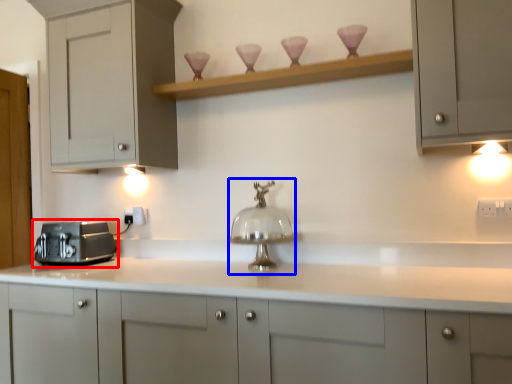
Question: Which point is further to the camera, home appliance (highlighted by a red box) or faucet (highlighted by a blue box)?

Choices:
 (A) home appliance
 (B) faucet

Answer: (A)